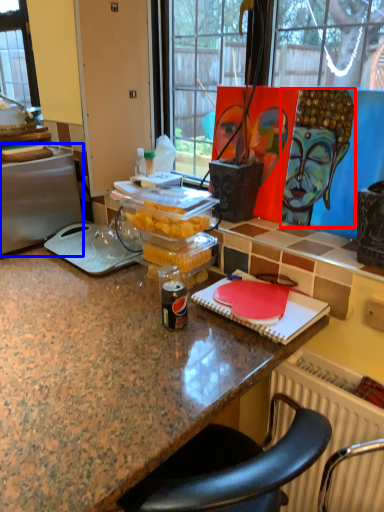
Question: Among these objects, which one is farthest to the camera, person (highlighted by a red box) or appliance (highlighted by a blue box)?

Choices:
 (A) person
 (B) appliance

Answer: (B)